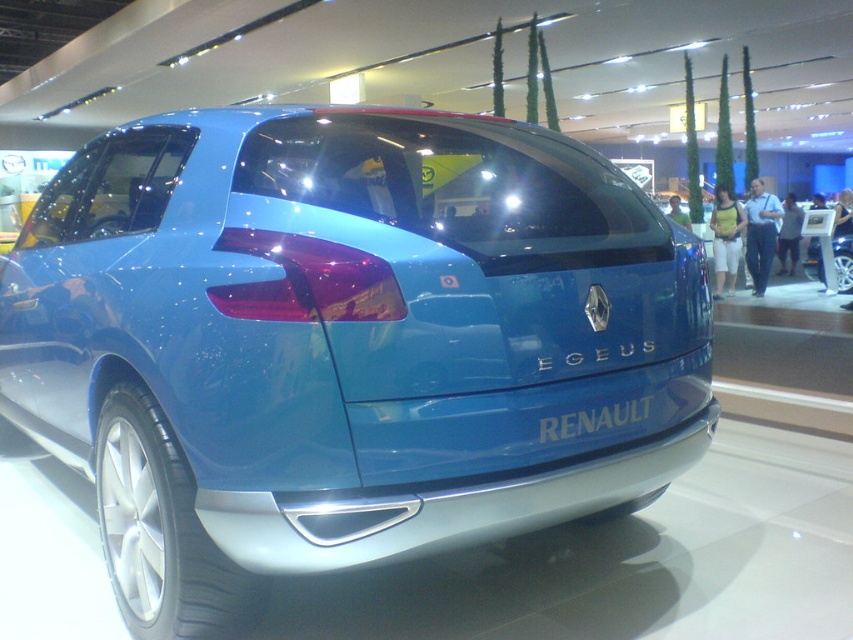
Is glossy blue car at center further to the viewer compared to matte blue car at center?

No, glossy blue car at center is in front of matte blue car at center.

Who is taller, glossy blue car at center or matte blue car at center?

With more height is glossy blue car at center.

Who is more forward, (329,568) or (804,227)?

Point (329,568) is more forward.

Locate an element on the screen. The width and height of the screenshot is (853, 640). glossy blue car at center is located at coordinates (345, 342).